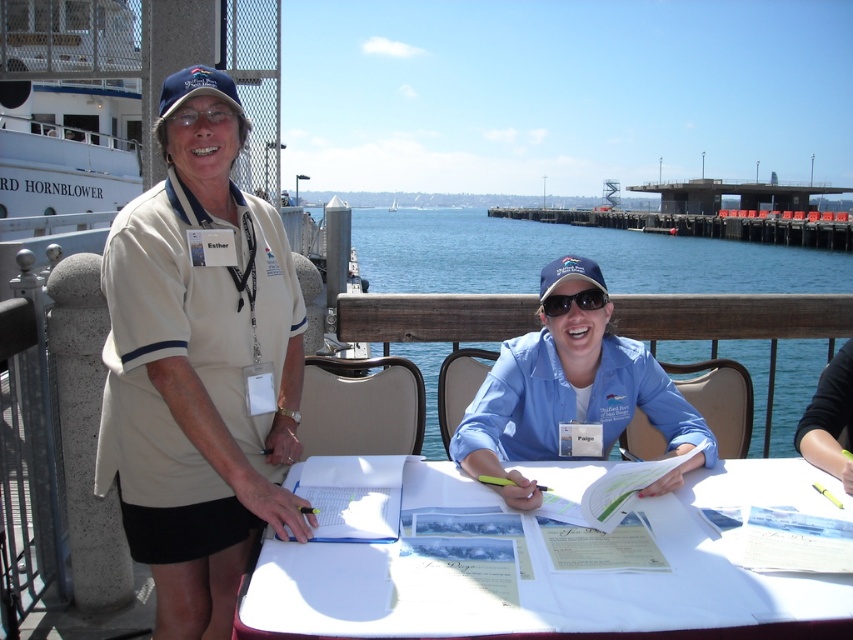
How distant is beige fabric shirt at left from blue water at center?

They are 14.40 meters apart.

Is point (270, 234) positioned after point (724, 349)?

No.

Which is in front, point (196, 467) or point (430, 342)?

Point (196, 467) is in front.

I want to click on beige fabric shirt at left, so click(200, 364).

Which is more to the right, blue cotton shirt at center or matte black sunglasses at center?

matte black sunglasses at center is more to the right.

Measure the distance from blue cotton shirt at center to matte black sunglasses at center.

They are 9.05 inches apart.

Does point (525, 460) come closer to viewer compared to point (579, 298)?

No, (525, 460) is behind (579, 298).

At what (x,y) coordinates should I click in order to perform the action: click on blue cotton shirt at center. Please return your answer as a coordinate pair (x, y). Looking at the image, I should click on (572, 396).

Can you confirm if white paper at center is positioned below matte black sunglasses at center?

Indeed, white paper at center is positioned under matte black sunglasses at center.

Which is behind, point (323, 580) or point (599, 296)?

The point (599, 296) is behind.

The height and width of the screenshot is (640, 853). Identify the location of white paper at center. (554, 570).